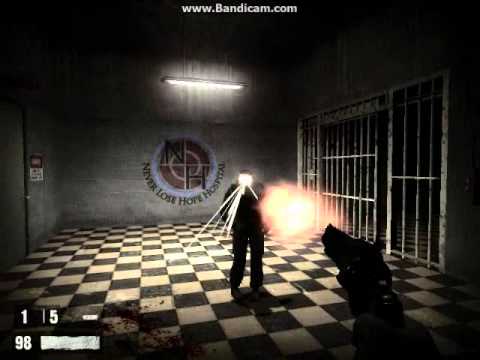
Where is `checkered floor`? The height and width of the screenshot is (360, 480). checkered floor is located at coordinates point(167,281).